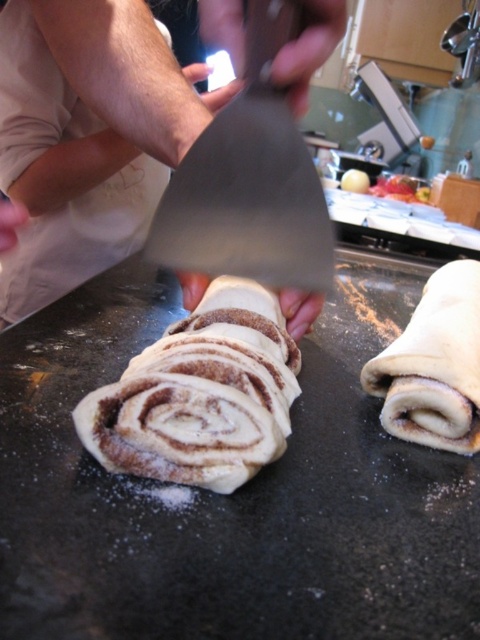
Question: Considering the relative positions of cinnamon-sugar swirl pastry at center and metallic silver spatula at center in the image provided, where is cinnamon-sugar swirl pastry at center located with respect to metallic silver spatula at center?

Choices:
 (A) left
 (B) right

Answer: (A)

Question: Where is cinnamon-sugar swirl pastry at center located in relation to metallic silver spatula at center in the image?

Choices:
 (A) above
 (B) below

Answer: (B)

Question: Does cinnamon-sugar swirl pastry at center have a larger size compared to metallic silver spatula at center?

Choices:
 (A) yes
 (B) no

Answer: (A)

Question: Which point is farther to the camera?

Choices:
 (A) (233, 403)
 (B) (308, 163)

Answer: (B)

Question: Which object appears closest to the camera in this image?

Choices:
 (A) metallic silver spatula at center
 (B) brown dough at center
 (C) cinnamon-sugar dough at center

Answer: (A)

Question: Among these objects, which one is farthest from the camera?

Choices:
 (A) metallic silver spatula at center
 (B) brown dough at center
 (C) cinnamon-sugar dough at center

Answer: (C)